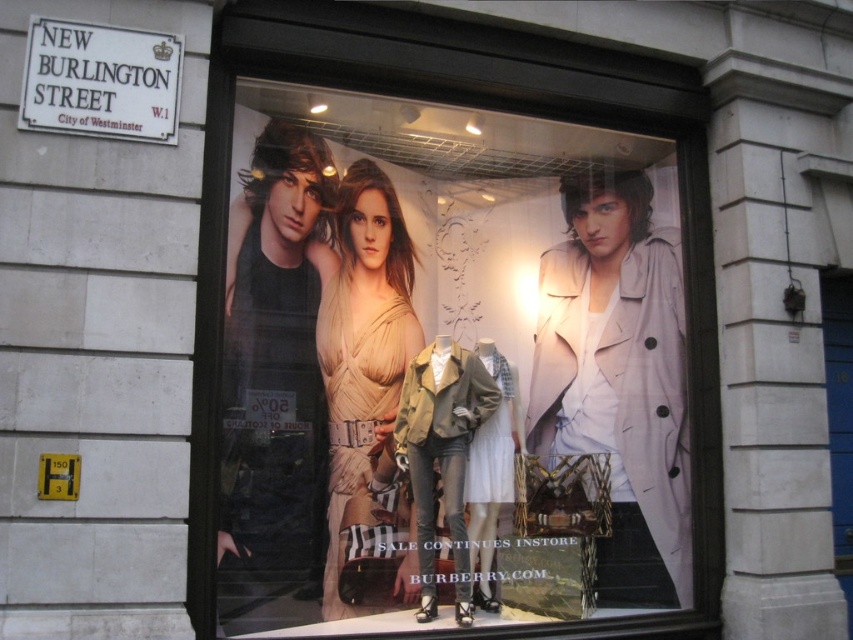
Question: Does matte beige dress at center appear on the right side of white stone street sign at upper left?

Choices:
 (A) yes
 (B) no

Answer: (A)

Question: Which of the following is the closest to the observer?

Choices:
 (A) matte beige dress at center
 (B) white stone street sign at upper left

Answer: (B)

Question: Can you confirm if matte beige dress at center is thinner than white stone street sign at upper left?

Choices:
 (A) yes
 (B) no

Answer: (B)

Question: Which point is farther from the camera taking this photo?

Choices:
 (A) (375, 212)
 (B) (54, 70)

Answer: (A)

Question: Can you confirm if matte beige dress at center is bigger than white stone street sign at upper left?

Choices:
 (A) no
 (B) yes

Answer: (B)

Question: Among these objects, which one is farthest from the camera?

Choices:
 (A) matte beige dress at center
 (B) white stone street sign at upper left

Answer: (A)